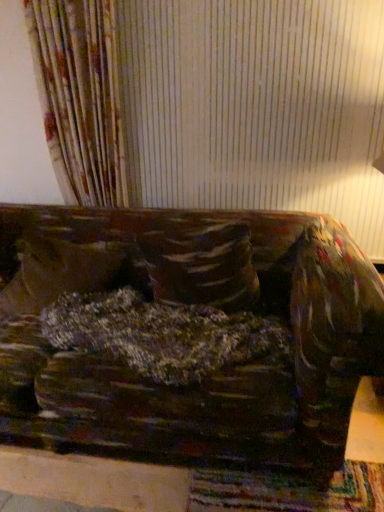
Question: Would you say velvety brown pillow at center, marked as the second pillow in a left-to-right arrangement, is outside velvet-like brown couch at center?

Choices:
 (A) yes
 (B) no

Answer: (A)

Question: Considering the relative positions of velvety brown pillow at center, which is counted as the first pillow, starting from the right, and velvet-like brown couch at center in the image provided, is velvety brown pillow at center, which is counted as the first pillow, starting from the right, behind velvet-like brown couch at center?

Choices:
 (A) no
 (B) yes

Answer: (B)

Question: Can you confirm if velvety brown pillow at center, marked as the second pillow in a left-to-right arrangement, is shorter than velvet-like brown couch at center?

Choices:
 (A) yes
 (B) no

Answer: (B)

Question: Is velvety brown pillow at center, which is counted as the first pillow, starting from the right, to the right of velvet-like brown couch at center from the viewer's perspective?

Choices:
 (A) yes
 (B) no

Answer: (B)

Question: Is velvety brown pillow at center, which is counted as the first pillow, starting from the right, wider than velvet-like brown couch at center?

Choices:
 (A) no
 (B) yes

Answer: (A)

Question: In terms of width, does velvet-like brown couch at center look wider or thinner when compared to velvety brown pillow at center, marked as the second pillow in a left-to-right arrangement?

Choices:
 (A) thin
 (B) wide

Answer: (B)

Question: Is velvet-like brown couch at center inside or outside of velvety brown pillow at center, marked as the second pillow in a left-to-right arrangement?

Choices:
 (A) inside
 (B) outside

Answer: (B)

Question: Is point click(x=59, y=248) closer or farther from the camera than point click(x=231, y=288)?

Choices:
 (A) closer
 (B) farther

Answer: (B)

Question: From the image's perspective, is velvet-like brown couch at center positioned above or below velvety brown pillow at center, which is counted as the first pillow, starting from the right?

Choices:
 (A) above
 (B) below

Answer: (B)

Question: From a real-world perspective, is velvety brown pillow at center, marked as the second pillow in a left-to-right arrangement, physically located above or below velvety brown pillow at center, placed as the first pillow when sorted from left to right?

Choices:
 (A) below
 (B) above

Answer: (B)

Question: In terms of width, does velvety brown pillow at center, which is counted as the first pillow, starting from the right, look wider or thinner when compared to velvety brown pillow at center, the 2th pillow when ordered from right to left?

Choices:
 (A) thin
 (B) wide

Answer: (A)

Question: From their relative heights in the image, would you say velvety brown pillow at center, marked as the second pillow in a left-to-right arrangement, is taller or shorter than velvety brown pillow at center, placed as the first pillow when sorted from left to right?

Choices:
 (A) short
 (B) tall

Answer: (B)

Question: Considering the positions of point (254, 290) and point (23, 289), is point (254, 290) closer or farther from the camera than point (23, 289)?

Choices:
 (A) farther
 (B) closer

Answer: (B)

Question: Considering the positions of velvet-like brown couch at center and velvety brown pillow at center, the 2th pillow when ordered from right to left, in the image, is velvet-like brown couch at center wider or thinner than velvety brown pillow at center, the 2th pillow when ordered from right to left,?

Choices:
 (A) wide
 (B) thin

Answer: (A)

Question: Visually, is velvet-like brown couch at center positioned to the left or to the right of velvety brown pillow at center, placed as the first pillow when sorted from left to right?

Choices:
 (A) right
 (B) left

Answer: (A)